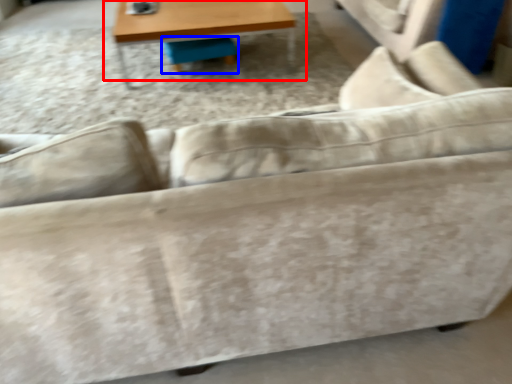
Question: Which point is closer to the camera, table (highlighted by a red box) or swivel chair (highlighted by a blue box)?

Choices:
 (A) table
 (B) swivel chair

Answer: (A)